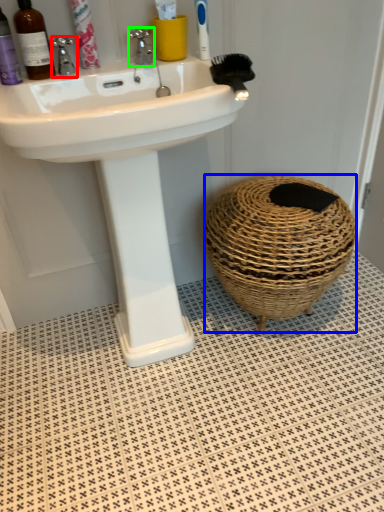
Question: Which object is positioned farthest from tap (highlighted by a red box)? Select from basket container (highlighted by a blue box) and tap (highlighted by a green box).

Choices:
 (A) basket container
 (B) tap

Answer: (A)